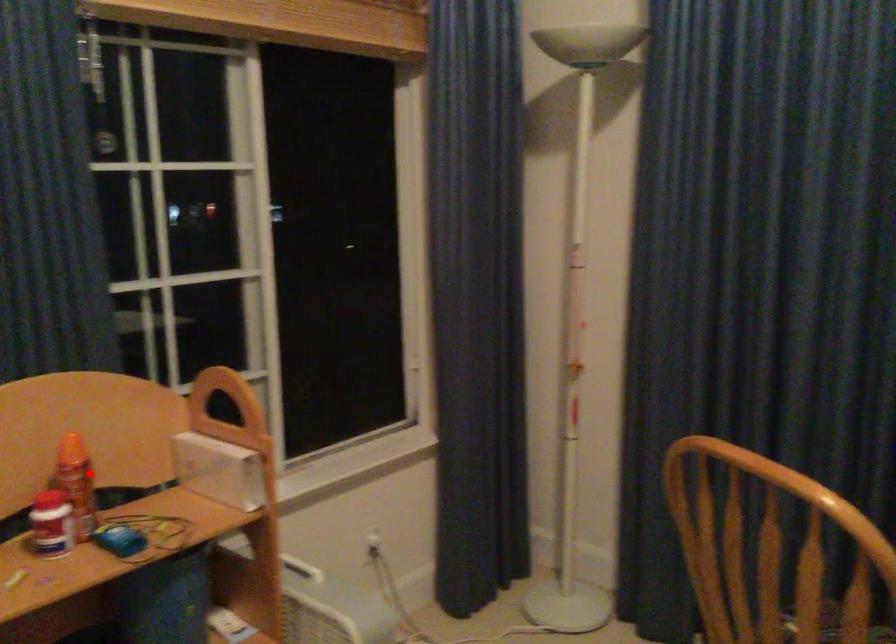
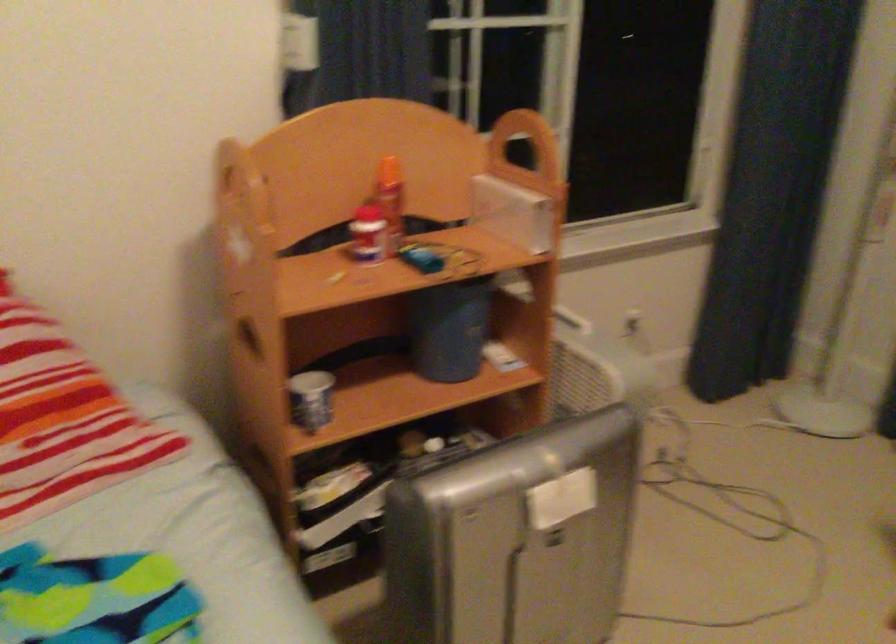
In the second image, find the point that corresponds to the highlighted location in the first image.

(391, 200)